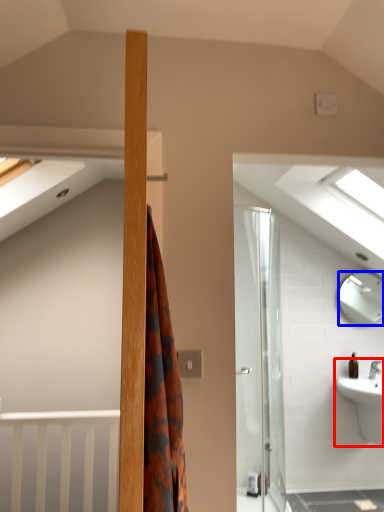
Question: Among these objects, which one is nearest to the camera, sink (highlighted by a red box) or mirror (highlighted by a blue box)?

Choices:
 (A) sink
 (B) mirror

Answer: (A)